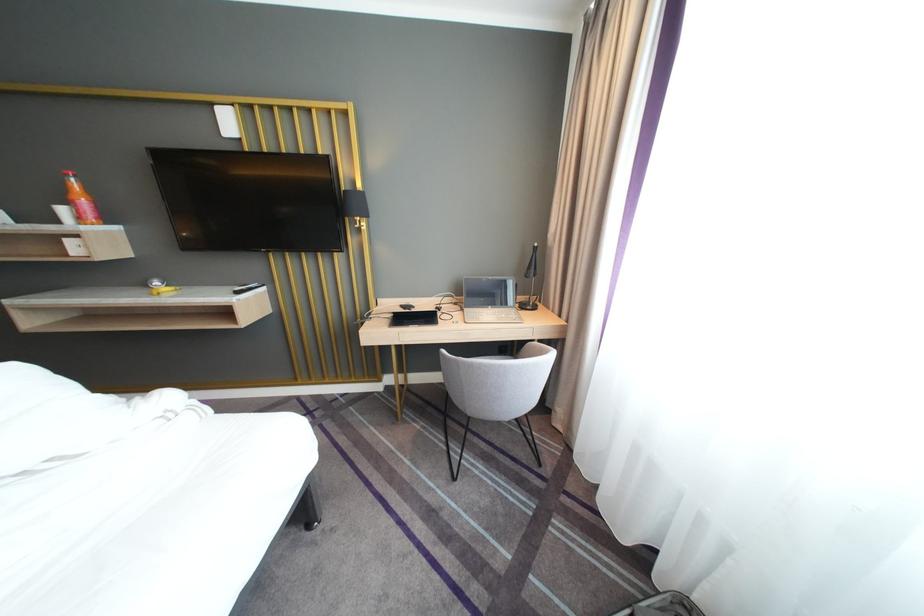
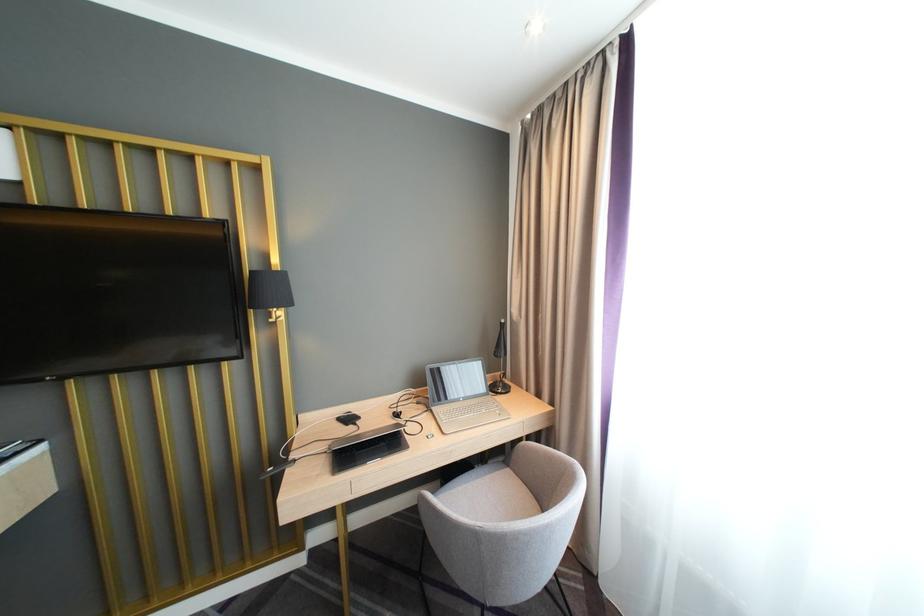
Question: The camera is either moving clockwise (left) or counter-clockwise (right) around the object. The first image is from the beginning of the video and the second image is from the end. Is the camera moving left or right when shooting the video?

Choices:
 (A) Left
 (B) Right

Answer: (A)